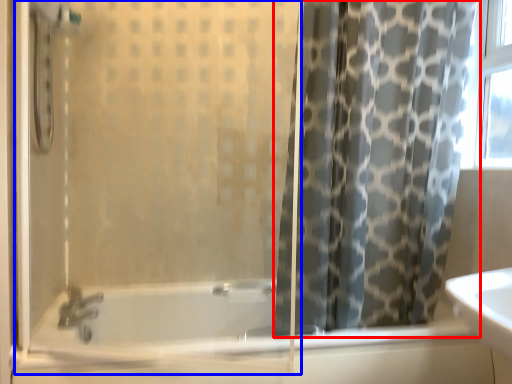
Question: Which point is further to the camera, curtain (highlighted by a red box) or screen door (highlighted by a blue box)?

Choices:
 (A) curtain
 (B) screen door

Answer: (A)